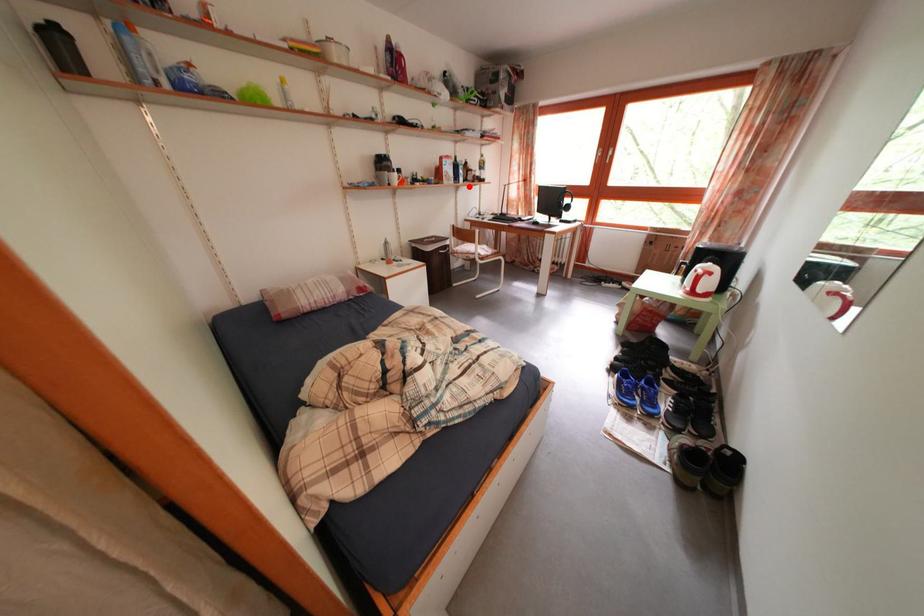
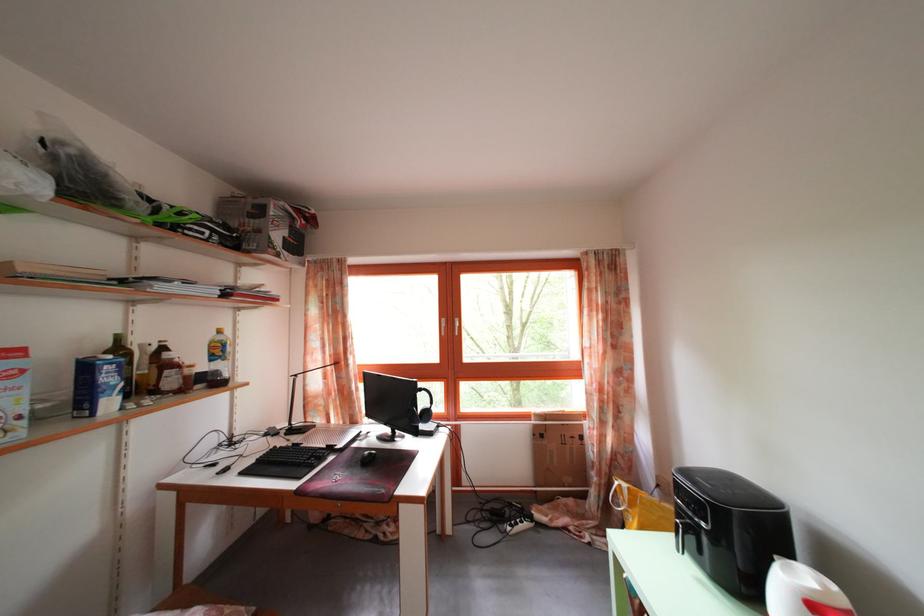
Question: I am providing you with two images of the same scene from different viewpoints. In image1, a red point is highlighted. Considering the same 3D point in image2, which of the following is correct?

Choices:
 (A) It is closer
 (B) It is farther

Answer: (B)